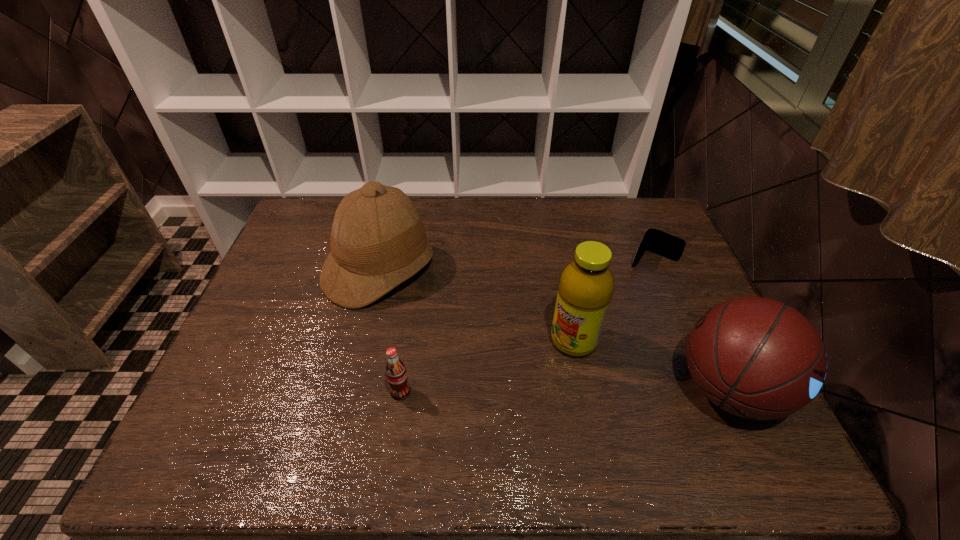
You are a GUI agent. You are given a task and a screenshot of the screen. Output one action in this format:
    pyautogui.click(x=<x>, y=<y>)
    Task: Click on the free point located on the front label of the fruit juice
    
    Given the screenshot: What is the action you would take?
    pyautogui.click(x=489, y=417)

Locate an element on the screen. free point located 0.170m on the front label of the fruit juice is located at coordinates (513, 395).

Identify the location of free region located 0.150m on the front label of the fruit juice. Image resolution: width=960 pixels, height=540 pixels. (518, 390).

The height and width of the screenshot is (540, 960). What are the coordinates of `free region located 0.360m on the front-facing side of the hat` in the screenshot? It's located at (512, 367).

You are a GUI agent. You are given a task and a screenshot of the screen. Output one action in this format:
    pyautogui.click(x=<x>, y=<y>)
    Task: Click on the vacant region located on the front-facing side of the hat
    
    Given the screenshot: What is the action you would take?
    pyautogui.click(x=496, y=356)

What are the coordinates of `blank area located 0.050m on the front-facing side of the hat` in the screenshot? It's located at (427, 306).

Locate an element on the screen. This screenshot has height=540, width=960. object present at the far edge is located at coordinates (378, 240).

The image size is (960, 540). I want to click on soda that is positioned at the near edge, so click(x=396, y=374).

You are a GUI agent. You are given a task and a screenshot of the screen. Output one action in this format:
    pyautogui.click(x=<x>, y=<y>)
    Task: Click on the basketball located at the near edge
    The height and width of the screenshot is (540, 960).
    Given the screenshot: What is the action you would take?
    pyautogui.click(x=757, y=358)

Find the location of `basketball present at the right edge`. basketball present at the right edge is located at coordinates (757, 358).